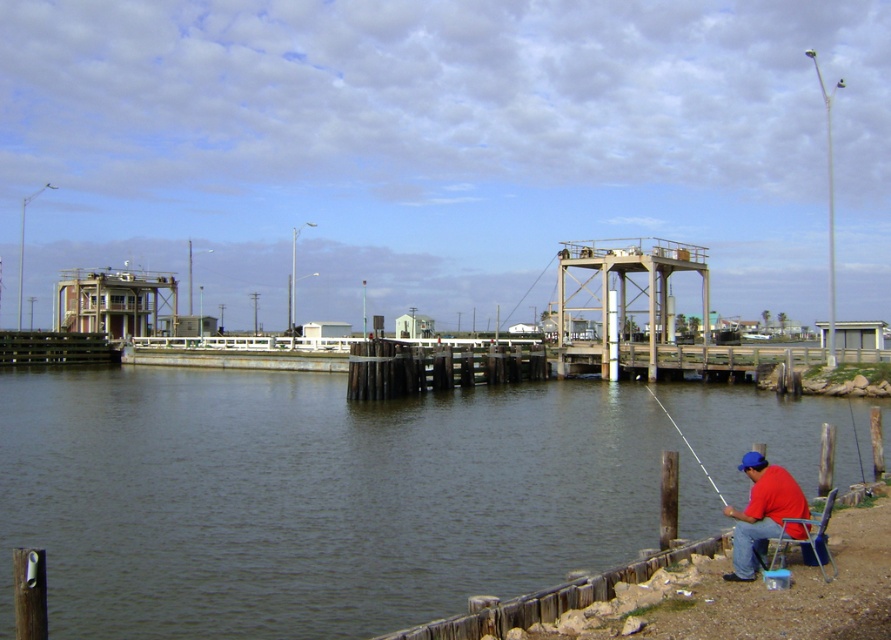
Question: Does dark gray water at lower left have a lesser width compared to red matte shirt at lower right?

Choices:
 (A) yes
 (B) no

Answer: (B)

Question: Is red matte shirt at lower right closer to camera compared to blue plastic chair at lower right?

Choices:
 (A) no
 (B) yes

Answer: (A)

Question: Which object is the closest to the dark gray water at lower left?

Choices:
 (A) blue plastic chair at lower right
 (B) white plastic fishing pole at lower right

Answer: (B)

Question: Does red matte shirt at lower right appear on the right side of white plastic fishing pole at lower right?

Choices:
 (A) no
 (B) yes

Answer: (A)

Question: Among these points, which one is nearest to the camera?

Choices:
 (A) (771, 566)
 (B) (762, 460)
 (C) (733, 490)

Answer: (A)

Question: Which object is the farthest from the white plastic fishing pole at lower right?

Choices:
 (A) red matte shirt at lower right
 (B) dark gray water at lower left
 (C) blue plastic chair at lower right

Answer: (A)